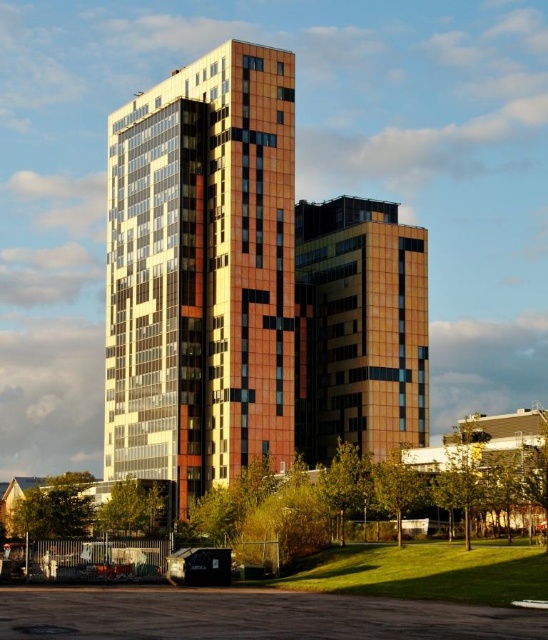
Does point (141, 166) come farther from viewer compared to point (351, 228)?

No, (141, 166) is in front of (351, 228).

Is multicolored mosaic building at center above orange glass building at center?

Yes, multicolored mosaic building at center is above orange glass building at center.

Find the location of a particular element. The image size is (548, 640). multicolored mosaic building at center is located at coordinates (202, 273).

In order to click on multicolored mosaic building at center in this screenshot , I will do `click(202, 273)`.